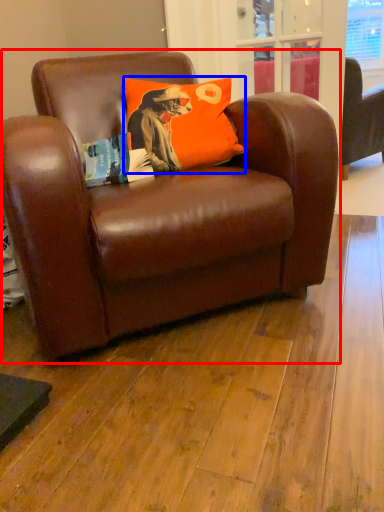
Question: Which point is closer to the camera, chair (highlighted by a red box) or pillow (highlighted by a blue box)?

Choices:
 (A) chair
 (B) pillow

Answer: (A)